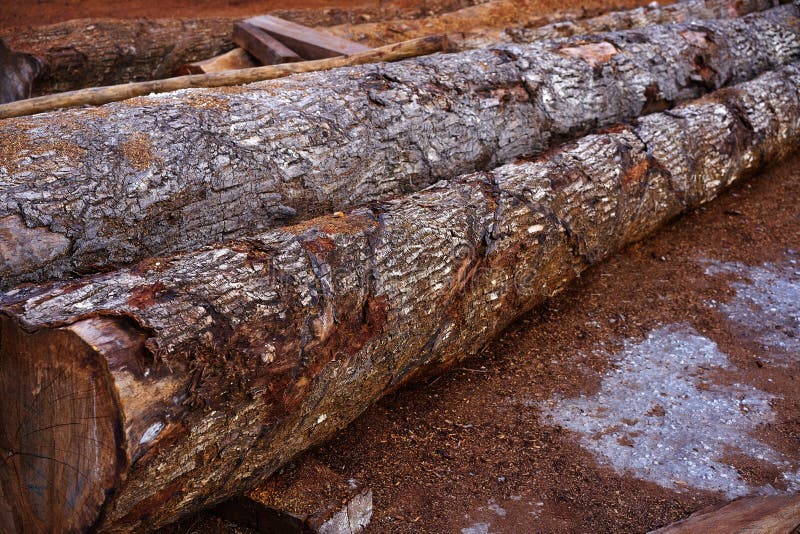
Find the location of a particular element. smooth wood is located at coordinates (132, 395).